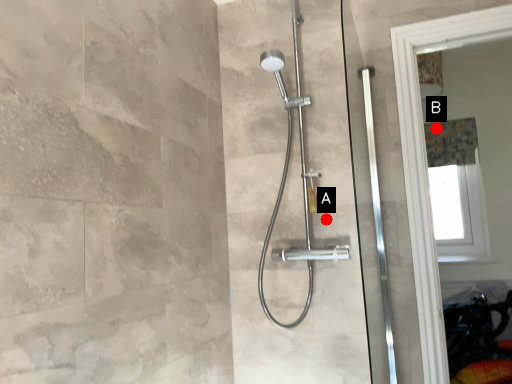
Question: Two points are circled on the image, labeled by A and B beside each circle. Among these points, which one is nearest to the camera?

Choices:
 (A) A is closer
 (B) B is closer

Answer: (A)